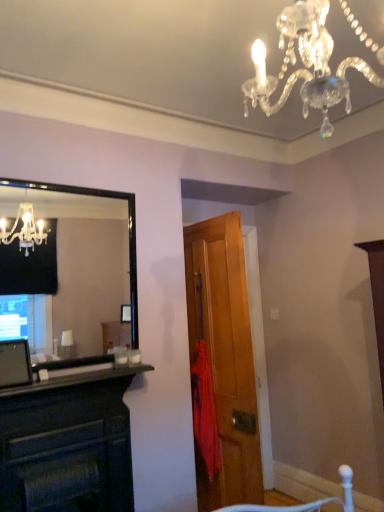
Measure the distance between point (237, 270) and camera.

Point (237, 270) and camera are 8.42 feet apart.

Identify the location of black matte fireplace at lower left. (74, 380).

Image resolution: width=384 pixels, height=512 pixels. What are the coordinates of `clear crystal chandelier at upper center` in the screenshot? It's located at (305, 65).

What do you see at coordinates (205, 411) in the screenshot? This screenshot has width=384, height=512. I see `red fabric umbrella at center` at bounding box center [205, 411].

This screenshot has height=512, width=384. I want to click on black glass mirror at left, so click(81, 264).

What do you see at coordinates (81, 264) in the screenshot?
I see `black glass mirror at left` at bounding box center [81, 264].

Locate an element on the screen. This screenshot has width=384, height=512. dark wood fireplace at left is located at coordinates (68, 444).

Is red fabric umbrella at center touching dark wood fireplace at left?

There is a gap between red fabric umbrella at center and dark wood fireplace at left.

At what (x,y) coordinates should I click in order to perform the action: click on curtain that is on the right side of dark wood fireplace at left. Please return your answer as a coordinate pair (x, y). The width and height of the screenshot is (384, 512). Looking at the image, I should click on (205, 411).

How distant is red fabric umbrella at center from dark wood fireplace at left?

red fabric umbrella at center is 28.75 inches from dark wood fireplace at left.

From the image's perspective, is red fabric umbrella at center below dark wood fireplace at left?

No, from the image's perspective, red fabric umbrella at center is not beneath dark wood fireplace at left.

From the picture: Considering the sizes of objects black glass mirror at left and red fabric umbrella at center in the image provided, who is taller, black glass mirror at left or red fabric umbrella at center?

red fabric umbrella at center.

Between black glass mirror at left and red fabric umbrella at center, which one has larger size?

black glass mirror at left is bigger.

The height and width of the screenshot is (512, 384). I want to click on curtain on the right of the black glass mirror at left, so click(x=205, y=411).

Would you say wooden door at center contains clear crystal chandelier at upper center?

No, wooden door at center does not contain clear crystal chandelier at upper center.

Is point (217, 279) closer or farther from the camera than point (283, 32)?

Point (217, 279) is farther from the camera than point (283, 32).

From the image's perspective, which is above, wooden door at center or clear crystal chandelier at upper center?

clear crystal chandelier at upper center appears higher in the image.

Is wooden door at center oriented towards red fabric umbrella at center?

Yes, wooden door at center is facing red fabric umbrella at center.

Considering the relative sizes of wooden door at center and red fabric umbrella at center in the image provided, is wooden door at center smaller than red fabric umbrella at center?

No, wooden door at center is not smaller than red fabric umbrella at center.

Is wooden door at center far from red fabric umbrella at center?

They are positioned close to each other.

Consider the image. Which object is further away from the camera, wooden door at center or red fabric umbrella at center?

red fabric umbrella at center is more distant.

In order to click on mirror located above the black matte fireplace at lower left (from a real-world perspective) in this screenshot , I will do `click(81, 264)`.

Is black glass mirror at left at the right side of black matte fireplace at lower left?

No.

Is point (41, 300) in front of point (16, 387)?

No, it is behind (16, 387).

From a real-world perspective, is clear crystal chandelier at upper center beneath red fabric umbrella at center?

Incorrect, from a real-world perspective, clear crystal chandelier at upper center is higher than red fabric umbrella at center.

Between clear crystal chandelier at upper center and red fabric umbrella at center, which one appears on the right side from the viewer's perspective?

clear crystal chandelier at upper center.

From the image's perspective, which is below, clear crystal chandelier at upper center or dark wood fireplace at left?

dark wood fireplace at left appears lower in the image.

Locate an element on the screen. The height and width of the screenshot is (512, 384). lamp on the right of dark wood fireplace at left is located at coordinates (305, 65).

Would you consider clear crystal chandelier at upper center to be distant from dark wood fireplace at left?

That's right, there is a large distance between clear crystal chandelier at upper center and dark wood fireplace at left.

Is clear crystal chandelier at upper center bigger or smaller than dark wood fireplace at left?

clear crystal chandelier at upper center is bigger than dark wood fireplace at left.

Where is `curtain lying on the right of dark wood fireplace at left`? curtain lying on the right of dark wood fireplace at left is located at coordinates (205, 411).

I want to click on mirror above the red fabric umbrella at center (from the image's perspective), so click(81, 264).

Looking at the image, which one is located further to clear crystal chandelier at upper center, red fabric umbrella at center or black matte fireplace at lower left?

Based on the image, red fabric umbrella at center appears to be further to clear crystal chandelier at upper center.

Estimate the real-world distances between objects in this image. Which object is further from clear crystal chandelier at upper center, dark wood fireplace at left or red fabric umbrella at center?

The object further to clear crystal chandelier at upper center is red fabric umbrella at center.

Estimate the real-world distances between objects in this image. Which object is further from red fabric umbrella at center, black glass mirror at left or black matte fireplace at lower left?

The object further to red fabric umbrella at center is black glass mirror at left.

Looking at the image, which one is located closer to black matte fireplace at lower left, clear crystal chandelier at upper center or dark wood fireplace at left?

Among the two, dark wood fireplace at left is located nearer to black matte fireplace at lower left.

Which object lies nearer to the anchor point black glass mirror at left, clear crystal chandelier at upper center or black matte fireplace at lower left?

black matte fireplace at lower left.

Looking at the image, which one is located closer to black matte fireplace at lower left, black glass mirror at left or clear crystal chandelier at upper center?

clear crystal chandelier at upper center lies closer to black matte fireplace at lower left than the other object.

Looking at this image, looking at the image, which one is located closer to dark wood fireplace at left, black glass mirror at left or red fabric umbrella at center?

red fabric umbrella at center.

From the image, which object appears to be nearer to dark wood fireplace at left, red fabric umbrella at center or black glass mirror at left?

The object closer to dark wood fireplace at left is red fabric umbrella at center.

Image resolution: width=384 pixels, height=512 pixels. Find the location of `mantle located between clear crystal chandelier at upper center and wooden door at center in the depth direction`. mantle located between clear crystal chandelier at upper center and wooden door at center in the depth direction is located at coordinates (74, 380).

This screenshot has height=512, width=384. I want to click on mantle between dark wood fireplace at left and wooden door at center, so click(74, 380).

Where is `curtain situated between black matte fireplace at lower left and wooden door at center from left to right`? Image resolution: width=384 pixels, height=512 pixels. curtain situated between black matte fireplace at lower left and wooden door at center from left to right is located at coordinates (205, 411).

The height and width of the screenshot is (512, 384). In order to click on door between clear crystal chandelier at upper center and dark wood fireplace at left in the up-down direction in this screenshot , I will do `click(225, 356)`.